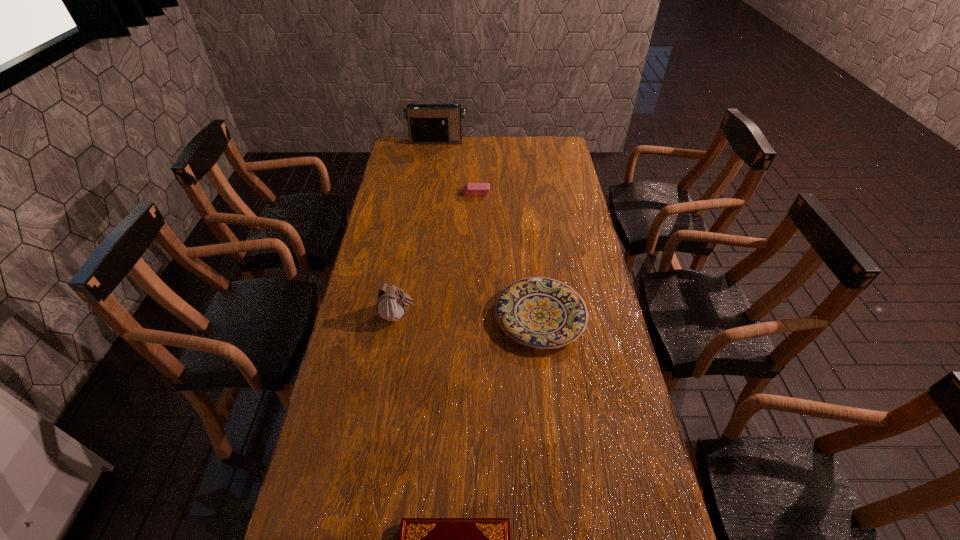
The width and height of the screenshot is (960, 540). What are the coordinates of `radio receiver that is positioned at the left edge` in the screenshot? It's located at (427, 123).

The height and width of the screenshot is (540, 960). What are the coordinates of `pouch that is at the left edge` in the screenshot? It's located at (392, 302).

What are the coordinates of `object located in the right edge section of the desktop` in the screenshot? It's located at (543, 313).

Where is `object situated at the far left corner`? This screenshot has height=540, width=960. object situated at the far left corner is located at coordinates (427, 123).

Locate an element on the screen. The height and width of the screenshot is (540, 960). free space at the far edge of the desktop is located at coordinates (524, 141).

The image size is (960, 540). In the image, there is a desktop. In order to click on blank space at the left edge in this screenshot , I will do `click(348, 418)`.

Where is `free point at the right edge`? free point at the right edge is located at coordinates (595, 373).

Locate an element on the screen. free spot between the farthest object and the pouch is located at coordinates (418, 228).

Identify the location of free space between the pouch and the radio receiver. (418, 228).

Where is `free area in between the tallest object and the plate`? The width and height of the screenshot is (960, 540). free area in between the tallest object and the plate is located at coordinates (489, 228).